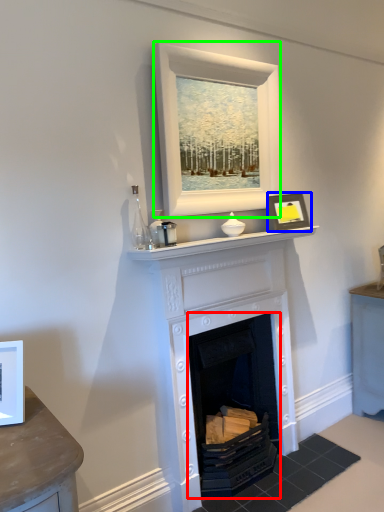
Question: Considering the real-world distances, which object is closest to fireplace (highlighted by a red box)? picture frame (highlighted by a blue box) or picture frame (highlighted by a green box).

Choices:
 (A) picture frame
 (B) picture frame

Answer: (A)